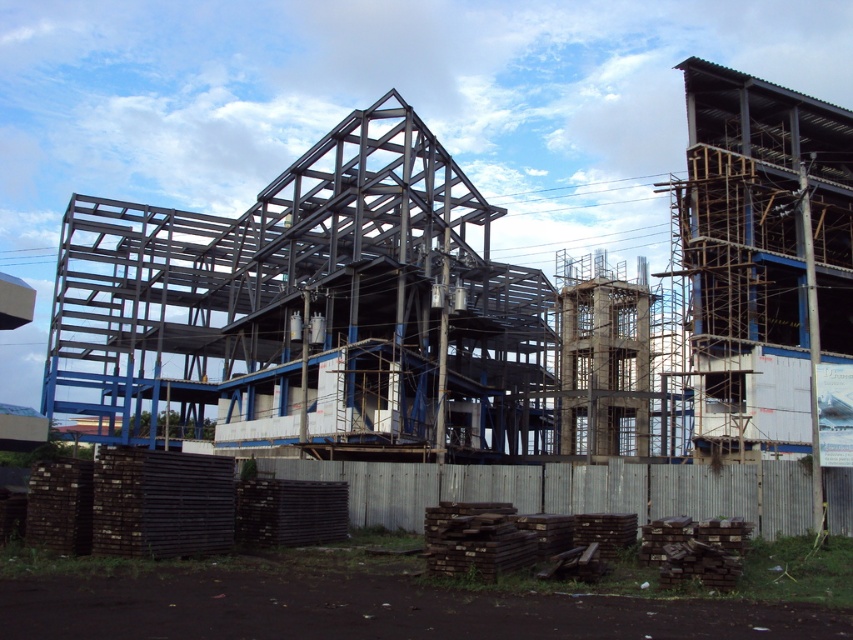
Does metal framework at center have a smaller size compared to gray wood fence at lower center?

Incorrect, metal framework at center is not smaller in size than gray wood fence at lower center.

Is metal framework at center closer to camera compared to gray wood fence at lower center?

No, it is behind gray wood fence at lower center.

The height and width of the screenshot is (640, 853). I want to click on metal framework at center, so click(x=310, y=312).